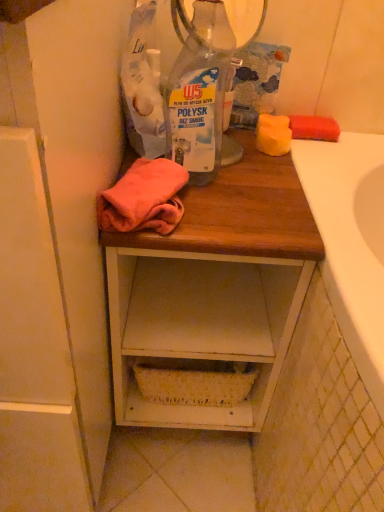
Locate an element on the screen. Image resolution: width=384 pixels, height=512 pixels. white wood cabinet at left is located at coordinates (56, 251).

The height and width of the screenshot is (512, 384). What do you see at coordinates (56, 251) in the screenshot? I see `white wood cabinet at left` at bounding box center [56, 251].

This screenshot has width=384, height=512. Find the location of `white wood cabinet at left`. white wood cabinet at left is located at coordinates (56, 251).

Between point (198, 170) and point (270, 173), which one is positioned in front?

The point (198, 170) is closer to the camera.

Is transparent plastic bottle at center aimed at wooden desk at center?

No.

Based on the photo, is transparent plastic bottle at center far from wooden desk at center?

Actually, transparent plastic bottle at center and wooden desk at center are a little close together.

From the image's perspective, is transparent plastic bottle at center below wooden desk at center?

No, from the image's perspective, transparent plastic bottle at center is not beneath wooden desk at center.

From a real-world perspective, between white wood cabinet at left and wooden desk at center, who is vertically lower?

wooden desk at center.

Considering the points (5, 216) and (241, 296), which point is in front, point (5, 216) or point (241, 296)?

The point (5, 216) is closer to the camera.

Is wooden desk at center inside white wood cabinet at left?

Definitely not — wooden desk at center is not inside white wood cabinet at left.

From the image's perspective, is white wood cabinet at left located above or below transparent plastic bottle at center?

Based on their image positions, white wood cabinet at left is located beneath transparent plastic bottle at center.

From a real-world perspective, is white wood cabinet at left above or below transparent plastic bottle at center?

In terms of real-world spatial position, white wood cabinet at left is below transparent plastic bottle at center.

Can you confirm if white wood cabinet at left is wider than transparent plastic bottle at center?

Yes.

Where is `bottle to the right of white wood cabinet at left`? bottle to the right of white wood cabinet at left is located at coordinates (198, 90).

From the picture: Which of these two, transparent plastic bottle at center or white wood cabinet at left, is bigger?

With larger size is white wood cabinet at left.

Relative to white wood cabinet at left, is transparent plastic bottle at center in front or behind?

In the image, transparent plastic bottle at center appears behind white wood cabinet at left.

How many degrees apart are the facing directions of transparent plastic bottle at center and white wood cabinet at left?

They differ by 0.939 degrees in their facing directions.

Is wooden desk at center next to white wood cabinet at left and touching it?

They are not placed beside each other.

Is wooden desk at center at the left side of white wood cabinet at left?

Incorrect, wooden desk at center is not on the left side of white wood cabinet at left.

Where is `desk that is under the white wood cabinet at left (from a real-world perspective)`? desk that is under the white wood cabinet at left (from a real-world perspective) is located at coordinates (214, 287).

Which is behind, wooden desk at center or white wood cabinet at left?

wooden desk at center is further from the camera.

From the image's perspective, is wooden desk at center over transparent plastic bottle at center?

Actually, wooden desk at center appears below transparent plastic bottle at center in the image.

Is wooden desk at center smaller than transparent plastic bottle at center?

No.

Is wooden desk at center placed right next to transparent plastic bottle at center?

No, wooden desk at center is not next to transparent plastic bottle at center.

Is wooden desk at center not inside transparent plastic bottle at center?

Indeed, wooden desk at center is completely outside transparent plastic bottle at center.

Locate an element on the screen. The image size is (384, 512). desk behind the transparent plastic bottle at center is located at coordinates (214, 287).

Image resolution: width=384 pixels, height=512 pixels. In order to click on desk on the right of white wood cabinet at left in this screenshot , I will do `click(214, 287)`.

From the image, which object appears to be nearer to white wood cabinet at left, wooden desk at center or transparent plastic bottle at center?

Based on the image, wooden desk at center appears to be nearer to white wood cabinet at left.

Which object lies nearer to the anchor point wooden desk at center, white wood cabinet at left or transparent plastic bottle at center?

The object closer to wooden desk at center is white wood cabinet at left.

Which object lies further to the anchor point white wood cabinet at left, transparent plastic bottle at center or wooden desk at center?

Based on the image, transparent plastic bottle at center appears to be further to white wood cabinet at left.

Based on their spatial positions, is wooden desk at center or white wood cabinet at left closer to transparent plastic bottle at center?

The object closer to transparent plastic bottle at center is wooden desk at center.

When comparing their distances from transparent plastic bottle at center, does white wood cabinet at left or wooden desk at center seem further?

white wood cabinet at left lies further to transparent plastic bottle at center than the other object.

Which object lies further to the anchor point wooden desk at center, transparent plastic bottle at center or white wood cabinet at left?

The object further to wooden desk at center is transparent plastic bottle at center.

What are the coordinates of `desk between white wood cabinet at left and transparent plastic bottle at center from left to right` in the screenshot? It's located at (214, 287).